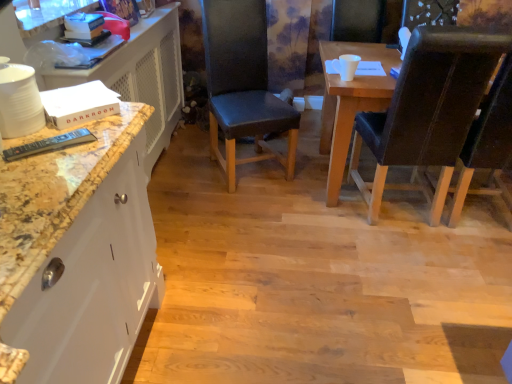
At what (x,y) coordinates should I click in order to perform the action: click on vacant space in front of black leather chair at right, which is the second chair in right-to-left order. Please return your answer as a coordinate pair (x, y). Image resolution: width=512 pixels, height=384 pixels. Looking at the image, I should click on (419, 267).